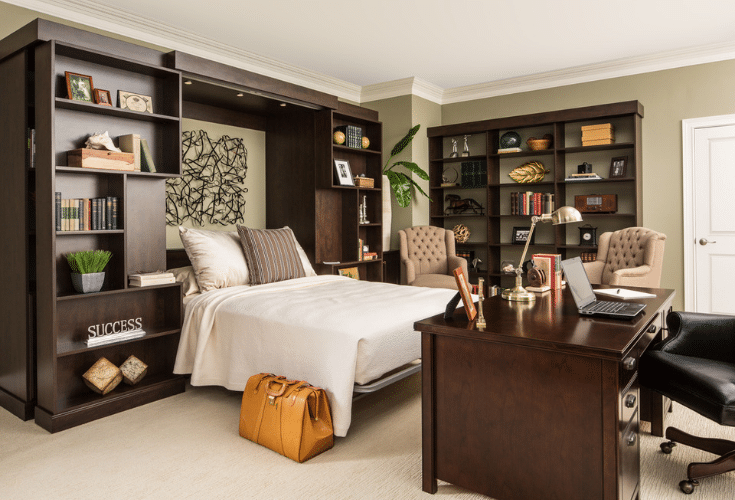
The image size is (735, 500). In order to click on laptop in this screenshot , I will do `click(595, 315)`.